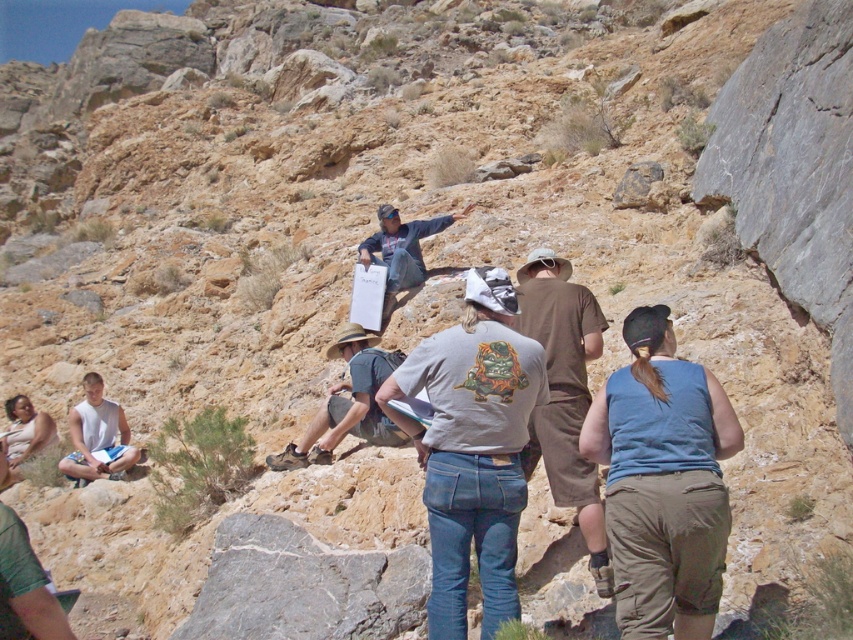
Question: From the image, what is the correct spatial relationship of brown cotton shirt at center in relation to camouflage fabric shirt at lower left?

Choices:
 (A) below
 (B) above

Answer: (B)

Question: Which object is closer to the camera taking this photo?

Choices:
 (A) white cotton tank top at lower left
 (B) gray fabric shirt at center

Answer: (B)

Question: Is gray cotton t-shirt at center smaller than camouflage fabric shirt at lower left?

Choices:
 (A) yes
 (B) no

Answer: (A)

Question: Which object is positioned closest to the gray cotton t-shirt at center?

Choices:
 (A) camouflage fabric shirt at lower left
 (B) brown cotton shirt at center

Answer: (B)

Question: Is gray cotton t-shirt at center below blue denim jeans at center?

Choices:
 (A) yes
 (B) no

Answer: (A)

Question: Based on their relative distances, which object is farther from the camouflage fabric shirt at lower left?

Choices:
 (A) brown cotton shirt at center
 (B) gray fabric shirt at center
 (C) blue denim jeans at center
 (D) gray cotton t-shirt at center

Answer: (C)